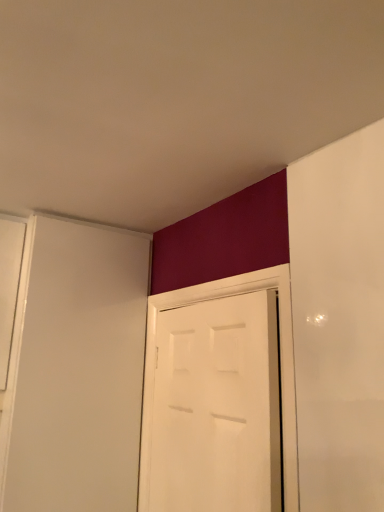
This screenshot has width=384, height=512. Describe the element at coordinates (281, 366) in the screenshot. I see `white matte door at center` at that location.

I want to click on white matte door at center, so click(281, 366).

This screenshot has width=384, height=512. In order to click on white matte door at center in this screenshot , I will do `click(281, 366)`.